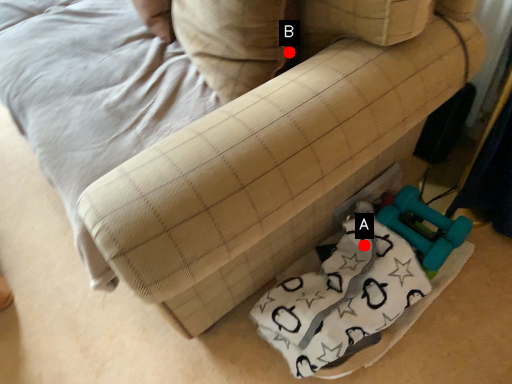
Question: Two points are circled on the image, labeled by A and B beside each circle. Which point is further to the camera?

Choices:
 (A) A is further
 (B) B is further

Answer: (A)